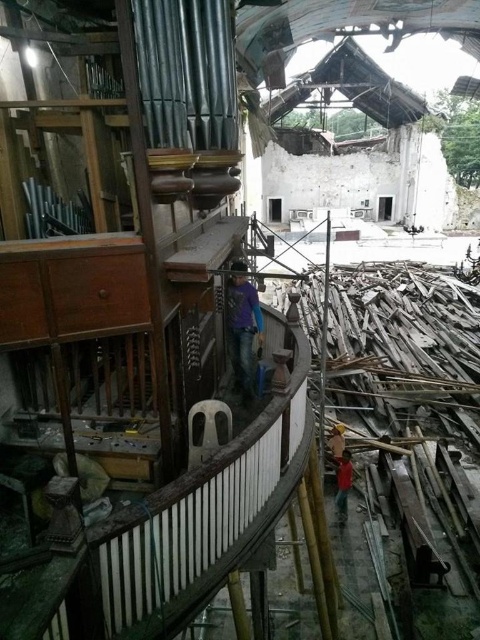
You are a safety inspector in the building. You see a purple matte shirt at center and a red matte shirt at lower right. Which shirt is closer to you?

The purple matte shirt at center is closer to you because it is in front of the red matte shirt at lower right.

You are standing in the partially demolished building and want to reach a specific location marked by point (230, 304). There is another point (339, 428) in the same area. Which point is closer to your current position?

Point (230, 304) is closer to the camera than point (339, 428), so the point (230, 304) is closer to your current position.